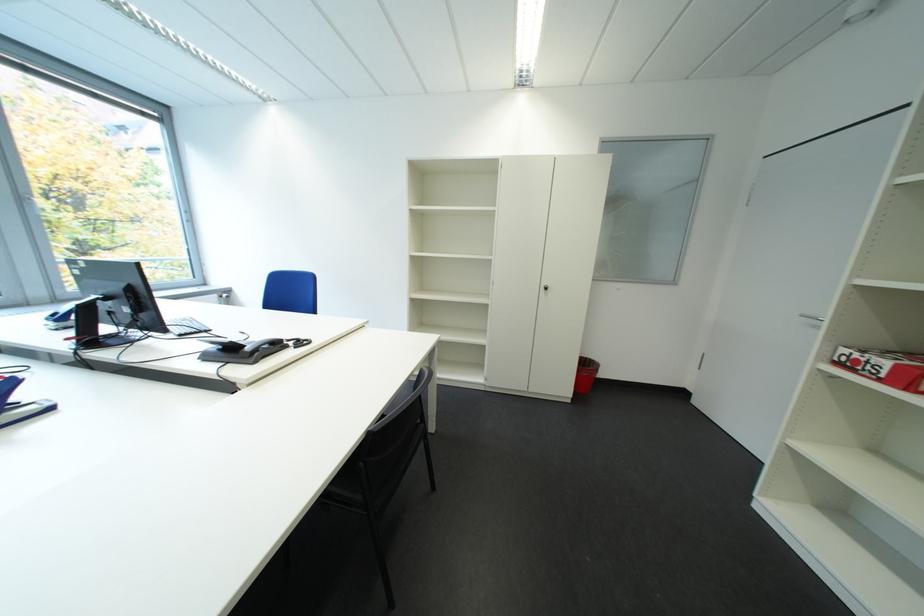
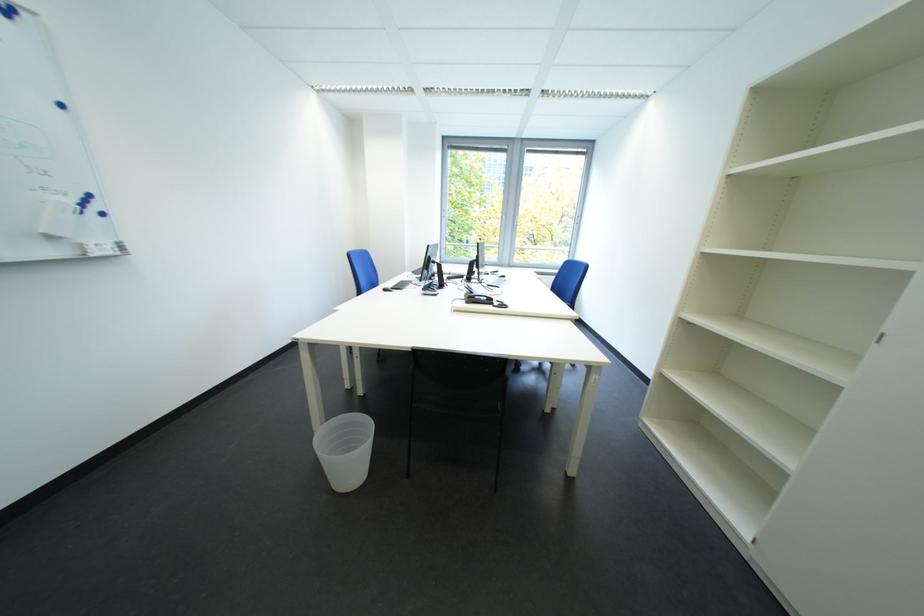
Locate, in the second image, the point that corresponds to (x=269, y=353) in the first image.

(485, 300)